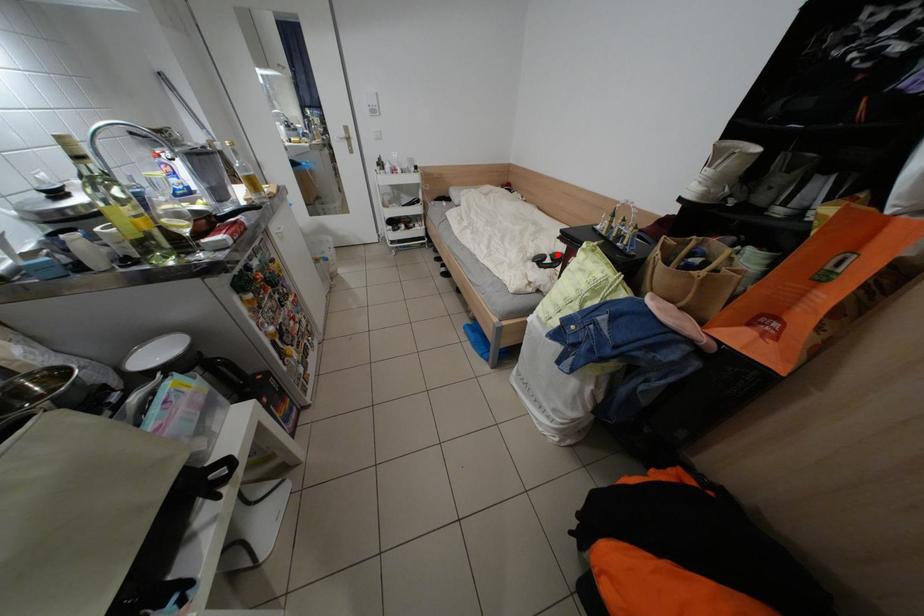
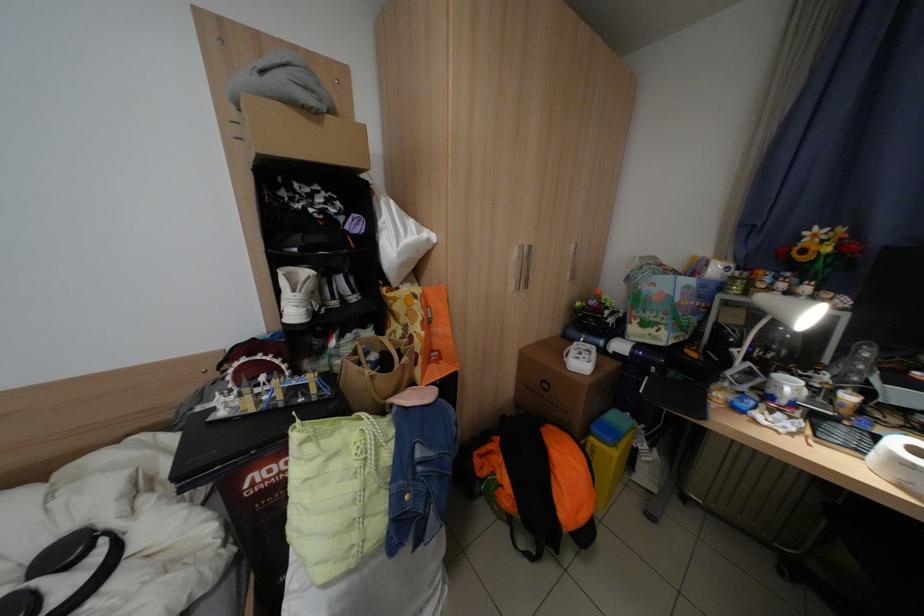
In the second image, find the point that corresponds to the highlighted location in the first image.

(17, 593)